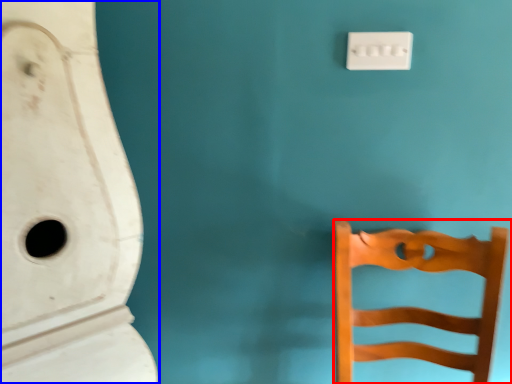
Question: Which object appears closest to the camera in this image, furniture (highlighted by a red box) or urinal (highlighted by a blue box)?

Choices:
 (A) furniture
 (B) urinal

Answer: (B)